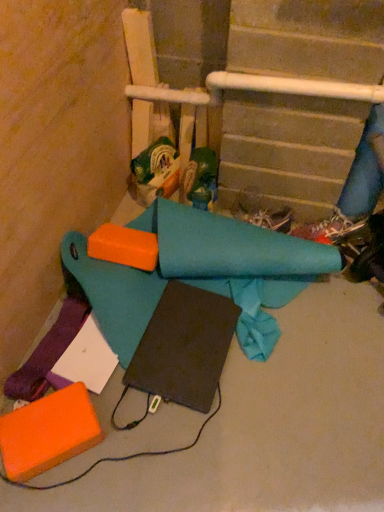
Find the location of a particular element. This screenshot has width=384, height=512. green cardboard box at center, the second toy in the right-to-left sequence is located at coordinates pyautogui.click(x=155, y=170).

What is the approximate height of black matte notebook at center?

black matte notebook at center is 5.28 centimeters in height.

This screenshot has width=384, height=512. What do you see at coordinates (184, 347) in the screenshot?
I see `black matte notebook at center` at bounding box center [184, 347].

Measure the distance between point (350,200) and camera.

The depth of point (350,200) is 1.53 meters.

Image resolution: width=384 pixels, height=512 pixels. What do you see at coordinates (200, 179) in the screenshot? I see `teal fabric cone at center, marked as the second toy in a left-to-right arrangement` at bounding box center [200, 179].

Image resolution: width=384 pixels, height=512 pixels. I want to click on teal fabric at center, which is the second fabric from right to left, so click(x=198, y=274).

How distant is teal fabric cone at center, marked as the second toy in a left-to-right arrangement, from black matte notebook at center?

They are 20.35 inches apart.

Is teal fabric cone at center, marked as the second toy in a left-to-right arrangement, closer to the viewer compared to black matte notebook at center?

No, the depth of teal fabric cone at center, marked as the second toy in a left-to-right arrangement, is greater than that of black matte notebook at center.

Locate an element on the screen. notebook to the left of teal fabric cone at center, marked as the second toy in a left-to-right arrangement is located at coordinates (184, 347).

From the image's perspective, is teal fabric cone at center, marked as the second toy in a left-to-right arrangement, above or below black matte notebook at center?

Clearly, from the image's perspective, teal fabric cone at center, marked as the second toy in a left-to-right arrangement, is above black matte notebook at center.

In terms of width, does teal fabric cone at center, marked as the second toy in a left-to-right arrangement, look wider or thinner when compared to teal fabric at center, which is the second fabric from right to left?

Considering their sizes, teal fabric cone at center, marked as the second toy in a left-to-right arrangement, looks slimmer than teal fabric at center, which is the second fabric from right to left.

In the scene shown: Does teal fabric cone at center, placed as the first toy when sorted from right to left, have a lesser height compared to teal fabric at center, which is the second fabric from right to left?

No.

Would you say teal fabric cone at center, marked as the second toy in a left-to-right arrangement, is outside teal fabric at center, marked as the second fabric in a left-to-right arrangement?

Yes.

From a real-world perspective, between black matte notebook at center and teal fabric at center, marked as the second fabric in a left-to-right arrangement, who is vertically lower?

black matte notebook at center, from a real-world perspective.

Which point is more forward, (201, 334) or (240, 253)?

The point (201, 334) is closer to the camera.

Which of these two, black matte notebook at center or teal fabric at center, which is the second fabric from right to left, is wider?

With larger width is teal fabric at center, which is the second fabric from right to left.

Is black matte notebook at center located outside teal fabric at center, which is the second fabric from right to left?

Actually, black matte notebook at center is within teal fabric at center, which is the second fabric from right to left.

Is point (211, 323) farther from viewer compared to point (146, 154)?

No.

Is green cardboard box at center, the first toy from the left, completely or partially inside black matte notebook at center?

No, green cardboard box at center, the first toy from the left, is not surrounded by black matte notebook at center.

Is black matte notebook at center taller than green cardboard box at center, the second toy in the right-to-left sequence?

Incorrect, the height of black matte notebook at center is not larger of that of green cardboard box at center, the second toy in the right-to-left sequence.

Who is smaller, black matte notebook at center or green cardboard box at center, the second toy in the right-to-left sequence?

black matte notebook at center.

From the image's perspective, which is below, black matte notebook at center or blue fabric at right, arranged as the third fabric when viewed from the left?

black matte notebook at center appears lower in the image.

In terms of width, does black matte notebook at center look wider or thinner when compared to blue fabric at right, which is the first fabric in right-to-left order?

Considering their sizes, black matte notebook at center looks broader than blue fabric at right, which is the first fabric in right-to-left order.

Considering the relative sizes of shiny black shoe at lower right and purple fabric at lower left, which appears as the third fabric when viewed from the right, in the image provided, is shiny black shoe at lower right smaller than purple fabric at lower left, which appears as the third fabric when viewed from the right,?

Actually, shiny black shoe at lower right might be larger than purple fabric at lower left, which appears as the third fabric when viewed from the right.

Considering the sizes of shiny black shoe at lower right and purple fabric at lower left, which ranks as the 1th fabric in left-to-right order, in the image, is shiny black shoe at lower right wider or thinner than purple fabric at lower left, which ranks as the 1th fabric in left-to-right order,?

shiny black shoe at lower right is thinner than purple fabric at lower left, which ranks as the 1th fabric in left-to-right order.

Could you tell me if shiny black shoe at lower right is turned towards purple fabric at lower left, which appears as the third fabric when viewed from the right?

No, shiny black shoe at lower right is not facing towards purple fabric at lower left, which appears as the third fabric when viewed from the right.

Is green cardboard box at center, the first toy from the left, taller or shorter than teal fabric at center, which is the second fabric from right to left?

green cardboard box at center, the first toy from the left, is taller than teal fabric at center, which is the second fabric from right to left.

In the image, is green cardboard box at center, the second toy in the right-to-left sequence, positioned in front of or behind teal fabric at center, which is the second fabric from right to left?

In the image, green cardboard box at center, the second toy in the right-to-left sequence, appears behind teal fabric at center, which is the second fabric from right to left.

Is green cardboard box at center, the first toy from the left, bigger than teal fabric at center, marked as the second fabric in a left-to-right arrangement?

Incorrect, green cardboard box at center, the first toy from the left, is not larger than teal fabric at center, marked as the second fabric in a left-to-right arrangement.

The width and height of the screenshot is (384, 512). What are the coordinates of `notebook below the teal fabric cone at center, marked as the second toy in a left-to-right arrangement (from a real-world perspective)` in the screenshot? It's located at (184, 347).

Identify the location of toy that is the 1st object located above the teal fabric at center, which is the second fabric from right to left (from the image's perspective). (200, 179).

Considering their positions, is green cardboard box at center, the first toy from the left, positioned closer to purple fabric at lower left, which appears as the third fabric when viewed from the right, than teal fabric cone at center, marked as the second toy in a left-to-right arrangement?

The object closer to purple fabric at lower left, which appears as the third fabric when viewed from the right, is green cardboard box at center, the first toy from the left.

Considering their positions, is shiny black shoe at lower right positioned further to black matte notebook at center than green cardboard box at center, the first toy from the left?

shiny black shoe at lower right lies further to black matte notebook at center than the other object.

From the image, which object appears to be farther from shiny black shoe at lower right, green cardboard box at center, the second toy in the right-to-left sequence, or teal fabric cone at center, marked as the second toy in a left-to-right arrangement?

green cardboard box at center, the second toy in the right-to-left sequence, is positioned further to the anchor shiny black shoe at lower right.

Considering their positions, is teal fabric at center, marked as the second fabric in a left-to-right arrangement, positioned further to blue fabric at right, arranged as the third fabric when viewed from the left, than black matte notebook at center?

Based on the image, black matte notebook at center appears to be further to blue fabric at right, arranged as the third fabric when viewed from the left.

Consider the image. When comparing their distances from shiny black shoe at lower right, does black matte notebook at center or teal fabric cone at center, marked as the second toy in a left-to-right arrangement, seem further?

black matte notebook at center is further to shiny black shoe at lower right.

Which object lies nearer to the anchor point green cardboard box at center, the second toy in the right-to-left sequence, teal fabric at center, which is the second fabric from right to left, or blue fabric at right, which is the first fabric in right-to-left order?

The object closer to green cardboard box at center, the second toy in the right-to-left sequence, is teal fabric at center, which is the second fabric from right to left.

In the scene shown: Based on their spatial positions, is teal fabric at center, which is the second fabric from right to left, or shiny black shoe at lower right further from blue fabric at right, which is the first fabric in right-to-left order?

A: The object further to blue fabric at right, which is the first fabric in right-to-left order, is teal fabric at center, which is the second fabric from right to left.

Considering their positions, is purple fabric at lower left, which ranks as the 1th fabric in left-to-right order, positioned further to shiny black shoe at lower right than blue fabric at right, which is the first fabric in right-to-left order?

Based on the image, purple fabric at lower left, which ranks as the 1th fabric in left-to-right order, appears to be further to shiny black shoe at lower right.

The image size is (384, 512). I want to click on fabric between teal fabric cone at center, placed as the first toy when sorted from right to left, and black matte notebook at center vertically, so click(198, 274).

You are a GUI agent. You are given a task and a screenshot of the screen. Output one action in this format:
    pyautogui.click(x=<x>, y=<y>)
    Task: Click on the toy situated between teal fabric at center, marked as the second fabric in a left-to-right arrangement, and blue fabric at right, arranged as the third fabric when viewed from the left, from left to right
    The width and height of the screenshot is (384, 512).
    Given the screenshot: What is the action you would take?
    pyautogui.click(x=200, y=179)

This screenshot has height=512, width=384. What are the coordinates of `notebook situated between green cardboard box at center, the first toy from the left, and shiny black shoe at lower right from left to right` in the screenshot? It's located at (184, 347).

Where is `notebook between green cardboard box at center, the first toy from the left, and purple fabric at lower left, which appears as the third fabric when viewed from the right, in the up-down direction`? notebook between green cardboard box at center, the first toy from the left, and purple fabric at lower left, which appears as the third fabric when viewed from the right, in the up-down direction is located at coordinates (184, 347).